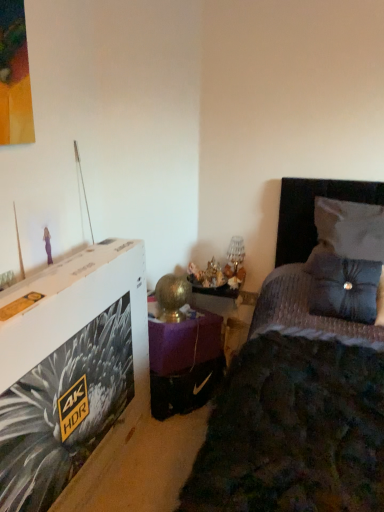
This screenshot has height=512, width=384. Describe the element at coordinates (184, 361) in the screenshot. I see `purple velvet table at center` at that location.

Identify the location of velvet dark blue bed at center. click(x=296, y=392).

Find the location of a particular element. purple velvet table at center is located at coordinates (184, 361).

Based on the photo, from a real-world perspective, does satin blue pillow at right, arranged as the 1th pillow when ordered from the bottom, sit lower than white fabric pillow at upper right, arranged as the first pillow when viewed from the top?

Yes, from a real-world perspective, satin blue pillow at right, arranged as the 1th pillow when ordered from the bottom, is below white fabric pillow at upper right, arranged as the first pillow when viewed from the top.

Looking at their sizes, would you say satin blue pillow at right, which ranks as the 2th pillow in top-to-bottom order, is wider or thinner than white fabric pillow at upper right, arranged as the first pillow when viewed from the top?

In the image, satin blue pillow at right, which ranks as the 2th pillow in top-to-bottom order, appears to be more narrow than white fabric pillow at upper right, arranged as the first pillow when viewed from the top.

Is point (321, 266) less distant than point (347, 250)?

Yes, point (321, 266) is in front of point (347, 250).

Can you confirm if satin blue pillow at right, arranged as the 1th pillow when ordered from the bottom, is taller than white fabric pillow at upper right, arranged as the first pillow when viewed from the top?

Indeed, satin blue pillow at right, arranged as the 1th pillow when ordered from the bottom, has a greater height compared to white fabric pillow at upper right, arranged as the first pillow when viewed from the top.

Is purple velvet table at center positioned behind velvet dark blue bed at center?

That is True.

Can you tell me how much purple velvet table at center and velvet dark blue bed at center differ in facing direction?

55.3 degrees separate the facing orientations of purple velvet table at center and velvet dark blue bed at center.

Is purple velvet table at center located outside velvet dark blue bed at center?

Yes.

Which object is positioned more to the right, purple velvet table at center or velvet dark blue bed at center?

Positioned to the right is velvet dark blue bed at center.

Is velvet dark blue bed at center facing away from purple velvet table at center?

No, velvet dark blue bed at center's orientation is not away from purple velvet table at center.

At what (x,y) coordinates should I click in order to perform the action: click on table located on the left of velvet dark blue bed at center. Please return your answer as a coordinate pair (x, y). This screenshot has width=384, height=512. Looking at the image, I should click on (184, 361).

Based on the photo, how many degrees apart are the facing directions of velvet dark blue bed at center and purple velvet table at center?

55.3 degrees separate the facing orientations of velvet dark blue bed at center and purple velvet table at center.

Which of these two, velvet dark blue bed at center or purple velvet table at center, stands taller?

velvet dark blue bed at center is taller.

Considering the sizes of objects satin blue pillow at right, which ranks as the 2th pillow in top-to-bottom order, and purple velvet table at center in the image provided, who is thinner, satin blue pillow at right, which ranks as the 2th pillow in top-to-bottom order, or purple velvet table at center?

satin blue pillow at right, which ranks as the 2th pillow in top-to-bottom order, is thinner.

From the image's perspective, does satin blue pillow at right, which ranks as the 2th pillow in top-to-bottom order, appear higher than purple velvet table at center?

Indeed, from the image's perspective, satin blue pillow at right, which ranks as the 2th pillow in top-to-bottom order, is shown above purple velvet table at center.

Is satin blue pillow at right, which ranks as the 2th pillow in top-to-bottom order, oriented towards purple velvet table at center?

No, satin blue pillow at right, which ranks as the 2th pillow in top-to-bottom order, is not oriented towards purple velvet table at center.

What are the coordinates of `the 2nd pillow directly above the velvet dark blue bed at center (from a real-world perspective)` in the screenshot? It's located at (351, 228).

Considering the positions of objects velvet dark blue bed at center and white fabric pillow at upper right, arranged as the first pillow when viewed from the top, in the image provided, who is behind, velvet dark blue bed at center or white fabric pillow at upper right, arranged as the first pillow when viewed from the top,?

white fabric pillow at upper right, arranged as the first pillow when viewed from the top, is further away from the camera.

Considering the positions of point (340, 380) and point (365, 210), is point (340, 380) closer or farther from the camera than point (365, 210)?

Point (340, 380) appears to be closer to the viewer than point (365, 210).

Is velvet dark blue bed at center shorter than white fabric pillow at upper right, the second pillow in the bottom-to-top sequence?

Incorrect, the height of velvet dark blue bed at center does not fall short of that of white fabric pillow at upper right, the second pillow in the bottom-to-top sequence.

Which is correct: white fabric pillow at upper right, arranged as the first pillow when viewed from the top, is inside satin blue pillow at right, arranged as the 1th pillow when ordered from the bottom, or outside of it?

white fabric pillow at upper right, arranged as the first pillow when viewed from the top, cannot be found inside satin blue pillow at right, arranged as the 1th pillow when ordered from the bottom.

Considering the sizes of objects white fabric pillow at upper right, arranged as the first pillow when viewed from the top, and satin blue pillow at right, arranged as the 1th pillow when ordered from the bottom, in the image provided, who is shorter, white fabric pillow at upper right, arranged as the first pillow when viewed from the top, or satin blue pillow at right, arranged as the 1th pillow when ordered from the bottom,?

white fabric pillow at upper right, arranged as the first pillow when viewed from the top.

From a real-world perspective, relative to satin blue pillow at right, which ranks as the 2th pillow in top-to-bottom order, is white fabric pillow at upper right, arranged as the first pillow when viewed from the top, vertically above or below?

From a real-world perspective, white fabric pillow at upper right, arranged as the first pillow when viewed from the top, is physically above satin blue pillow at right, which ranks as the 2th pillow in top-to-bottom order.

From the image's perspective, is white fabric pillow at upper right, the second pillow in the bottom-to-top sequence, positioned above or below satin blue pillow at right, arranged as the 1th pillow when ordered from the bottom?

Based on their image positions, white fabric pillow at upper right, the second pillow in the bottom-to-top sequence, is located above satin blue pillow at right, arranged as the 1th pillow when ordered from the bottom.

Could you tell me if white fabric pillow at upper right, arranged as the first pillow when viewed from the top, is turned towards velvet dark blue bed at center?

Yes, white fabric pillow at upper right, arranged as the first pillow when viewed from the top, is facing velvet dark blue bed at center.

From the velvet dark blue bed at center, count 2nd pillow to the right and point to it. Please provide its 2D coordinates.

[(351, 228)]

From a real-world perspective, is white fabric pillow at upper right, arranged as the first pillow when viewed from the top, above or below velvet dark blue bed at center?

white fabric pillow at upper right, arranged as the first pillow when viewed from the top, is situated higher than velvet dark blue bed at center in the real world.

Considering the relative sizes of white fabric pillow at upper right, the second pillow in the bottom-to-top sequence, and velvet dark blue bed at center in the image provided, is white fabric pillow at upper right, the second pillow in the bottom-to-top sequence, wider than velvet dark blue bed at center?

No, white fabric pillow at upper right, the second pillow in the bottom-to-top sequence, is not wider than velvet dark blue bed at center.

This screenshot has width=384, height=512. Find the location of `pillow above the satin blue pillow at right, arranged as the 1th pillow when ordered from the bottom (from a real-world perspective)`. pillow above the satin blue pillow at right, arranged as the 1th pillow when ordered from the bottom (from a real-world perspective) is located at coordinates (351, 228).

Where is `table below the velvet dark blue bed at center (from the image's perspective)`? table below the velvet dark blue bed at center (from the image's perspective) is located at coordinates (184, 361).

Considering their positions, is white fabric pillow at upper right, arranged as the first pillow when viewed from the top, positioned further to velvet dark blue bed at center than satin blue pillow at right, arranged as the 1th pillow when ordered from the bottom?

Based on the image, white fabric pillow at upper right, arranged as the first pillow when viewed from the top, appears to be further to velvet dark blue bed at center.

Based on their spatial positions, is velvet dark blue bed at center or purple velvet table at center further from satin blue pillow at right, arranged as the 1th pillow when ordered from the bottom?

purple velvet table at center lies further to satin blue pillow at right, arranged as the 1th pillow when ordered from the bottom, than the other object.

Looking at the image, which one is located further to velvet dark blue bed at center, purple velvet table at center or satin blue pillow at right, which ranks as the 2th pillow in top-to-bottom order?

purple velvet table at center is positioned further to the anchor velvet dark blue bed at center.

Consider the image. Based on their spatial positions, is white fabric pillow at upper right, the second pillow in the bottom-to-top sequence, or velvet dark blue bed at center further from purple velvet table at center?

white fabric pillow at upper right, the second pillow in the bottom-to-top sequence.

Looking at this image, which object lies nearer to the anchor point white fabric pillow at upper right, the second pillow in the bottom-to-top sequence, purple velvet table at center or velvet dark blue bed at center?

Based on the image, velvet dark blue bed at center appears to be nearer to white fabric pillow at upper right, the second pillow in the bottom-to-top sequence.

Estimate the real-world distances between objects in this image. Which object is further from white fabric pillow at upper right, arranged as the first pillow when viewed from the top, velvet dark blue bed at center or satin blue pillow at right, which ranks as the 2th pillow in top-to-bottom order?

The object further to white fabric pillow at upper right, arranged as the first pillow when viewed from the top, is velvet dark blue bed at center.

Consider the image. Looking at the image, which one is located closer to satin blue pillow at right, which ranks as the 2th pillow in top-to-bottom order, white fabric pillow at upper right, arranged as the first pillow when viewed from the top, or purple velvet table at center?

white fabric pillow at upper right, arranged as the first pillow when viewed from the top.

Based on their spatial positions, is velvet dark blue bed at center or white fabric pillow at upper right, arranged as the first pillow when viewed from the top, further from purple velvet table at center?

white fabric pillow at upper right, arranged as the first pillow when viewed from the top, is further to purple velvet table at center.

Find the location of a particular element. Image resolution: width=384 pixels, height=512 pixels. pillow located between velvet dark blue bed at center and white fabric pillow at upper right, arranged as the first pillow when viewed from the top, in the depth direction is located at coordinates pyautogui.click(x=343, y=287).

You are a GUI agent. You are given a task and a screenshot of the screen. Output one action in this format:
    pyautogui.click(x=<x>, y=<y>)
    Task: Click on the pillow situated between purple velvet table at center and white fabric pillow at upper right, arranged as the first pillow when viewed from the top, from left to right
    Image resolution: width=384 pixels, height=512 pixels.
    Given the screenshot: What is the action you would take?
    pyautogui.click(x=343, y=287)